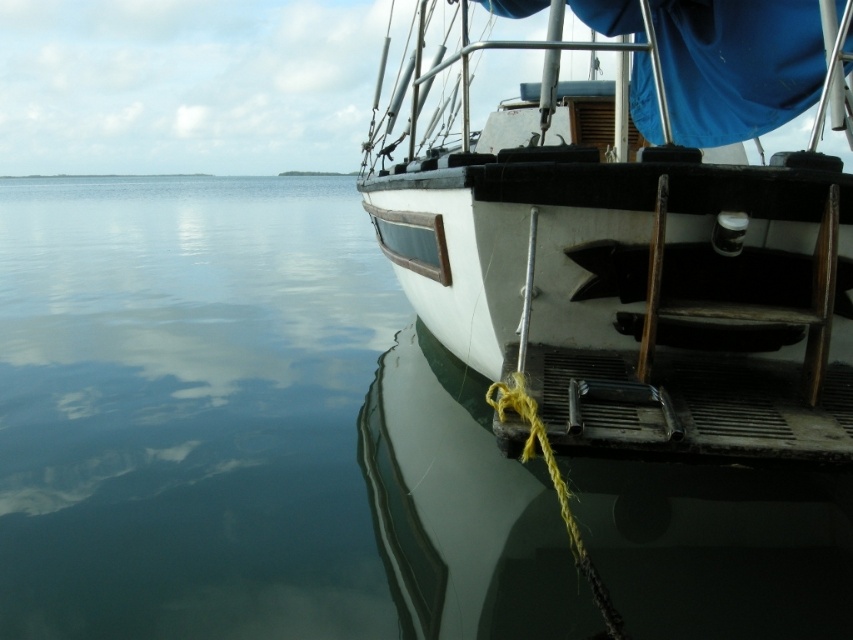
Question: Among these objects, which one is nearest to the camera?

Choices:
 (A) white matte boat at center
 (B) yellow string at lower center
 (C) clear water at lower left

Answer: (B)

Question: Which point is closer to the camera taking this photo?

Choices:
 (A) (614, 628)
 (B) (368, 241)
 (C) (840, 180)

Answer: (A)

Question: Is white matte boat at center to the left of yellow string at lower center from the viewer's perspective?

Choices:
 (A) no
 (B) yes

Answer: (A)

Question: Does white matte boat at center have a larger size compared to yellow string at lower center?

Choices:
 (A) yes
 (B) no

Answer: (A)

Question: Which point is farther from the camera taking this photo?

Choices:
 (A) (576, 560)
 (B) (26, 230)

Answer: (B)

Question: Is clear water at lower left wider than yellow string at lower center?

Choices:
 (A) no
 (B) yes

Answer: (B)